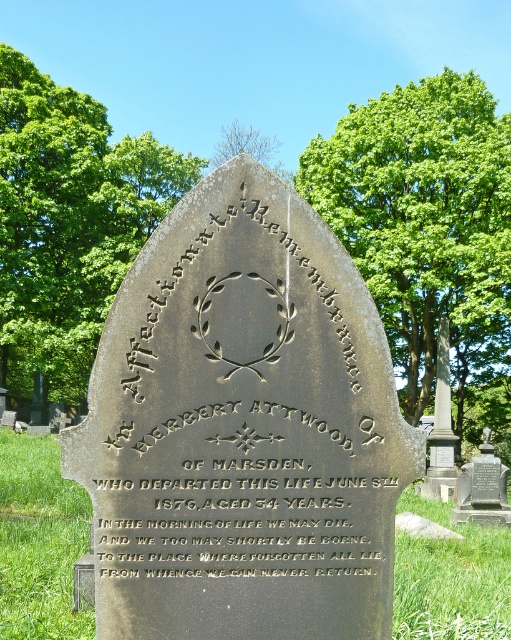
You are standing 2 meters away from the gravestone. Can you read the smaller text below the main inscription at point (379, 444) without moving closer?

The distance of point (379, 444) from the camera is 2.60 meters. Since you are standing 2 meters away from the gravestone, you are 0.6 meters closer than the point. Therefore, you can read the smaller text at point (379, 444) without moving closer.

You are standing in front of the gravestone and want to read the smaller text below the main inscription. Which part of the dark gray stone tombstone at center should you look at to find the gold engraved text at center?

The gold engraved text at center is located below the main inscription on the dark gray stone tombstone at center. Since the tombstone is closer to you, you can look downward from the main inscription to find the smaller text.